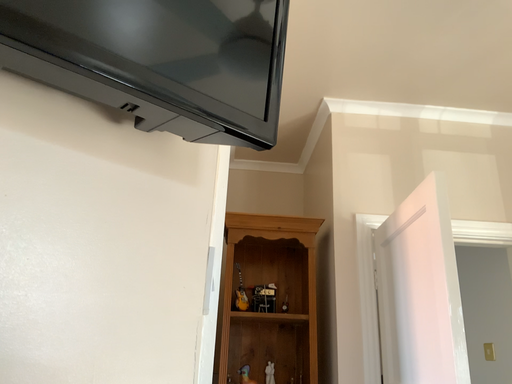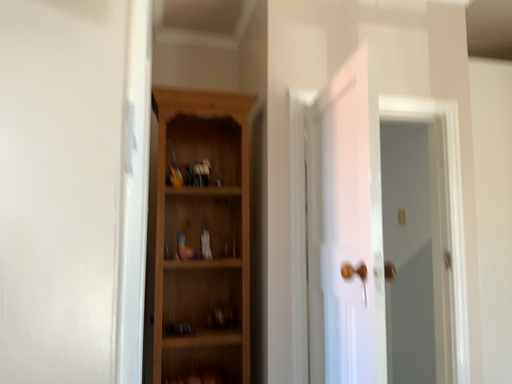
Question: Which way did the camera rotate in the video?

Choices:
 (A) rotated downward
 (B) rotated upward

Answer: (A)